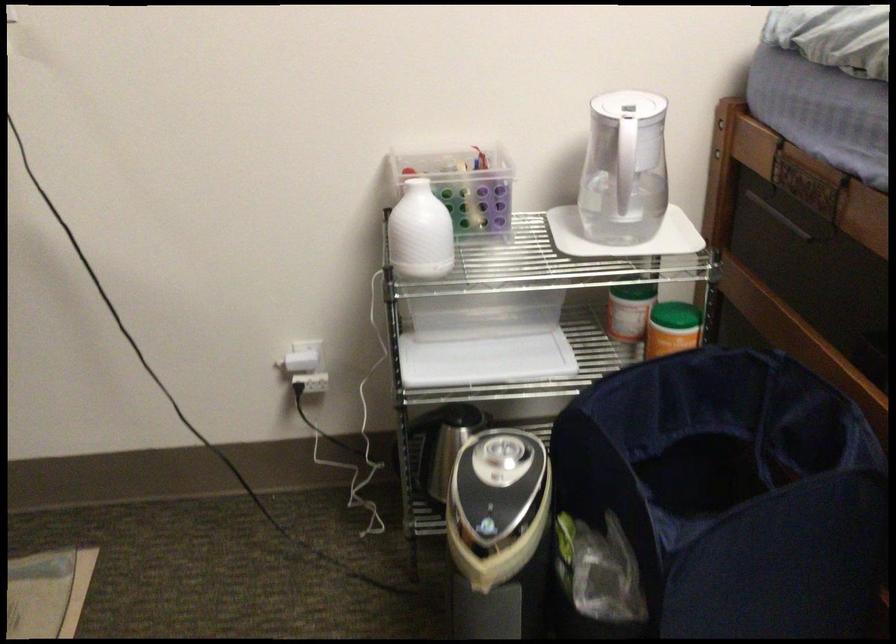
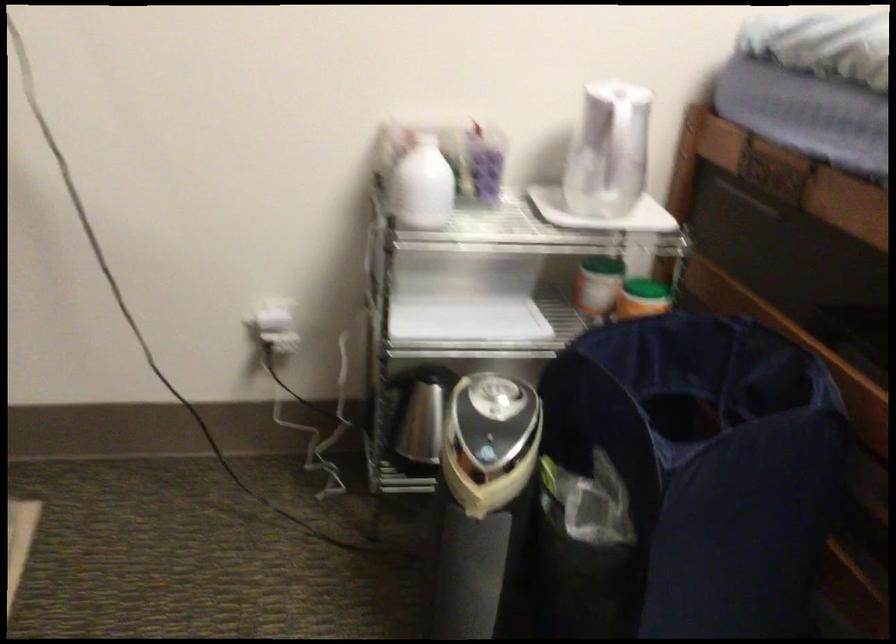
Find the pixel in the second image that matches point (414, 237) in the first image.

(421, 185)